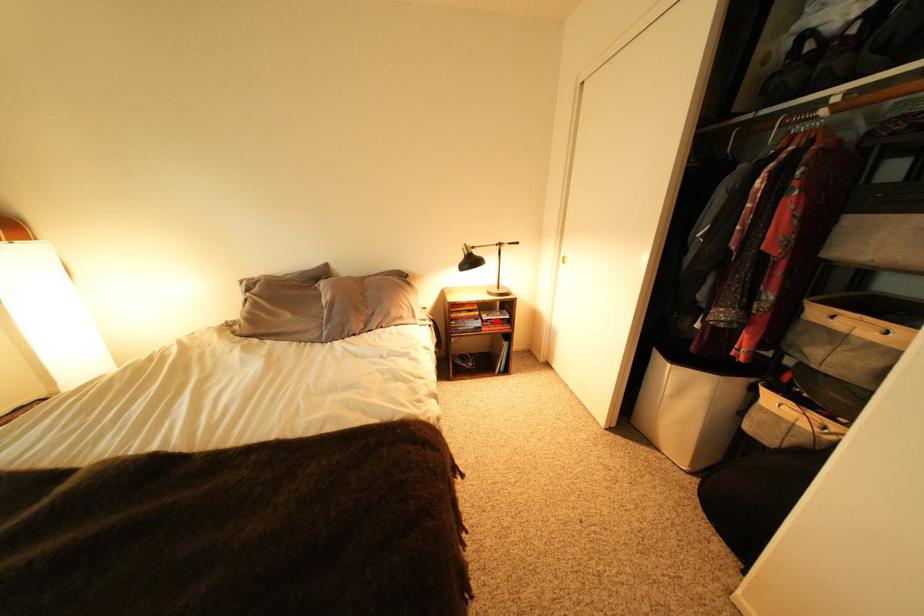
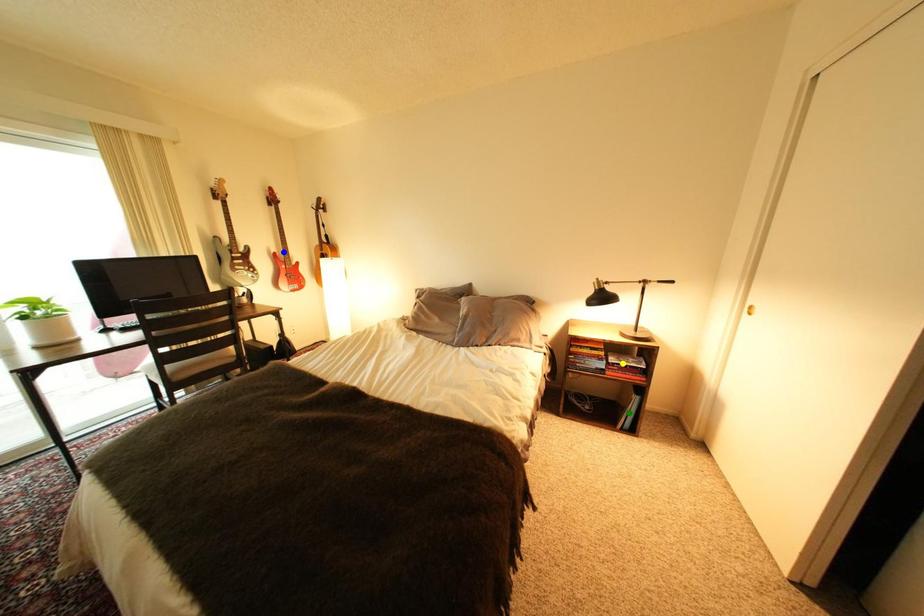
Question: I am providing you with two images of the same scene from different viewpoints. A red point is marked on the first image. You are given multiple points on the second image. Which mark in image 2 goes with the point in image 1?

Choices:
 (A) green point
 (B) yellow point
 (C) blue point

Answer: (B)